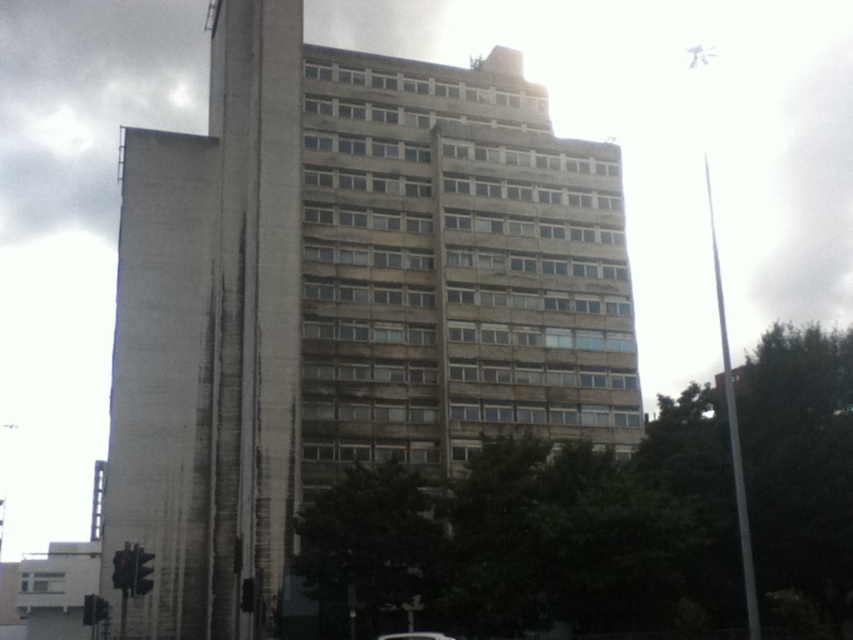
You are standing 100 meters away from a tall building. You see a point marked at coordinates point (404, 188) on the building. If the distance from you to that point is 66.48 meters, how much closer is the point compared to your original position?

The point marked at point (404, 188) is 66.48 meters away from you, which is 33.52 meters closer than your original position 100 meters away.

You are standing on the sidewalk in front of the concrete building at center and want to park your metallic silver car at lower center. Based on the scene, can you determine if the car is currently parked to the right or left side of the building?

The concrete building at center is positioned on the left side of the metallic silver car at lower center, so the car is parked to the right side of the building.

Consider the image. You are standing on the sidewalk in front of the concrete building at center. You see the metallic silver car at lower center. Is the car parked in front of the building or behind it?

The concrete building at center is positioned over the metallic silver car at lower center, which means the car is parked in front of the building.